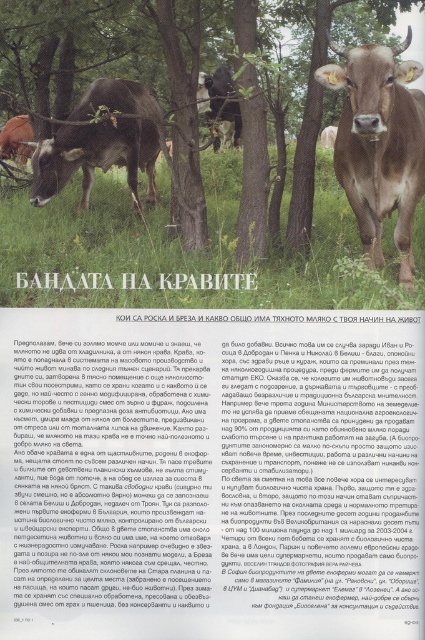
Question: Among these objects, which one is nearest to the camera?

Choices:
 (A) green leafy tree at center
 (B) brown glossy bull at center

Answer: (B)

Question: Considering the real-world distances, which object is farthest from the brown glossy bull at center?

Choices:
 (A) green grass at center
 (B) whitetextured papersign at center

Answer: (B)

Question: Can you confirm if whitetextured papersign at center is smaller than black glossy bull at center?

Choices:
 (A) yes
 (B) no

Answer: (A)

Question: Can you confirm if green grass at center is thinner than brown glossy bull at center?

Choices:
 (A) no
 (B) yes

Answer: (A)

Question: Which point appears farthest from the camera in this image?

Choices:
 (A) (68, 244)
 (B) (257, 285)
 (C) (28, 120)
 (D) (365, 131)

Answer: (C)

Question: In this image, where is green leafy tree at center located relative to brown glossy bull at center?

Choices:
 (A) right
 (B) left

Answer: (B)